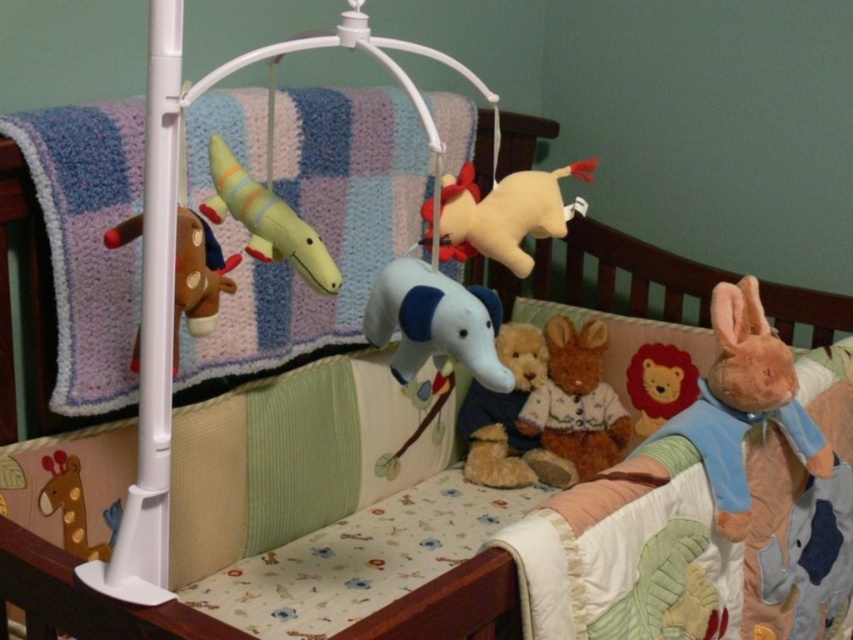
Question: Is fluffy beige teddy bear at center bigger than matte red plush lion at center?

Choices:
 (A) no
 (B) yes

Answer: (B)

Question: Can you confirm if brown plush rabbit at center is positioned below brown plush horse at left?

Choices:
 (A) no
 (B) yes

Answer: (B)

Question: Among these points, which one is farthest from the camera?

Choices:
 (A) (462, 419)
 (B) (49, 486)
 (C) (186, 285)

Answer: (A)

Question: Does soft beige plush unicorn at center have a smaller size compared to fluffy beige teddy bear at center?

Choices:
 (A) yes
 (B) no

Answer: (B)

Question: Based on their relative distances, which object is nearer to the brown plush horse at left?

Choices:
 (A) blue plush elephant at center
 (B) knitted wool blanket at upper left
 (C) matte yellow plush crocodile at upper center
 (D) fluffy orange rabbit at right

Answer: (C)

Question: Based on their relative distances, which object is farther from the fluffy beige teddy bear at center?

Choices:
 (A) matte yellow giraffe at lower left
 (B) fluffy orange rabbit at right

Answer: (A)